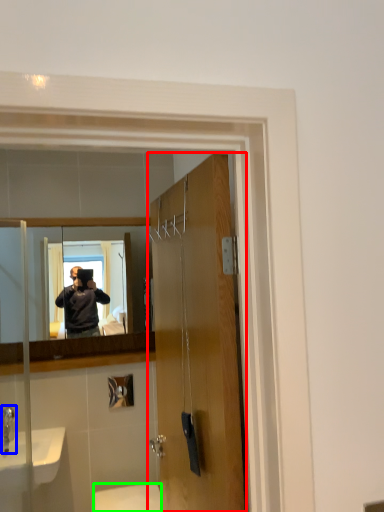
Question: Based on their relative distances, which object is nearer to door (highlighted by a red box)? Choose from faucet (highlighted by a blue box) and toilet (highlighted by a green box).

Choices:
 (A) faucet
 (B) toilet

Answer: (A)